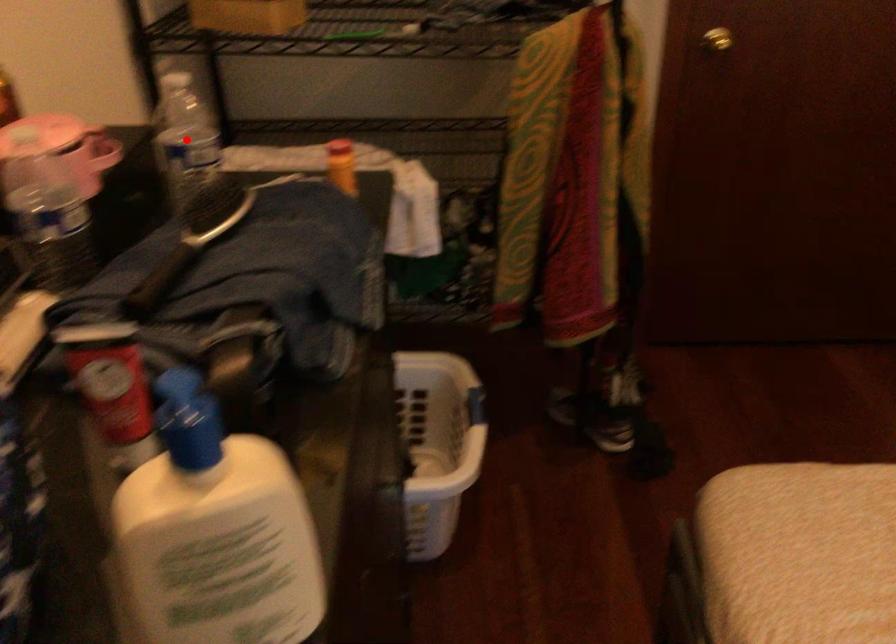
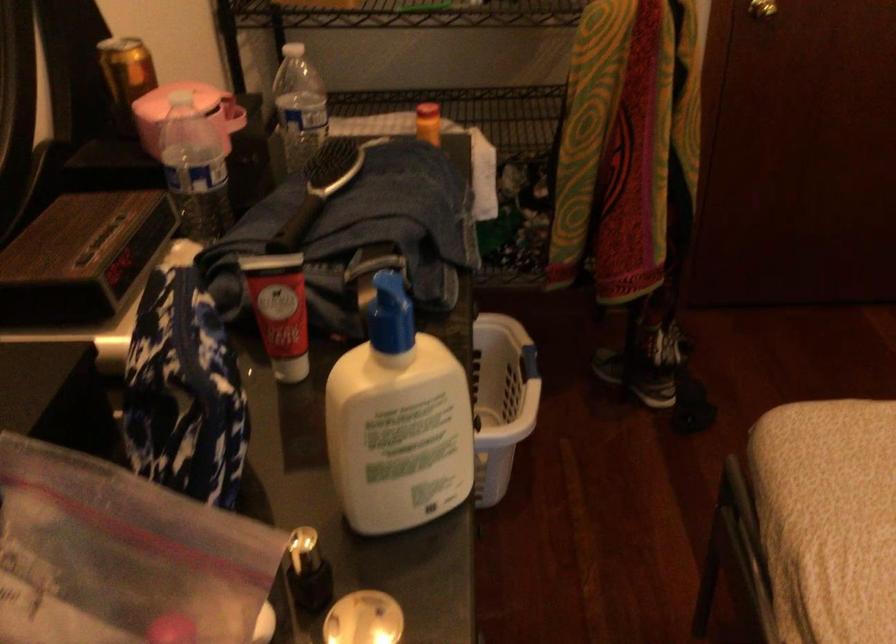
Question: I am providing you with two images of the same scene from different viewpoints. Given a red point in image1, look at the same physical point in image2. Is it:

Choices:
 (A) Closer to the viewpoint
 (B) Farther from the viewpoint

Answer: (B)